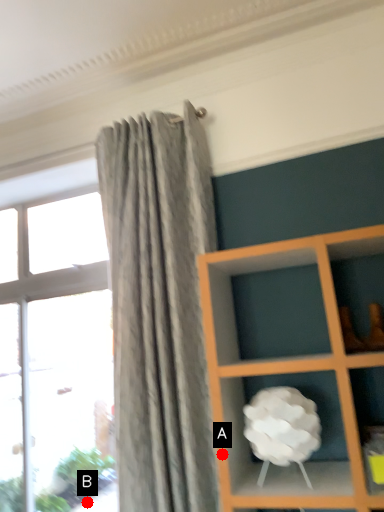
Question: Two points are circled on the image, labeled by A and B beside each circle. Which point is closer to the camera?

Choices:
 (A) A is closer
 (B) B is closer

Answer: (A)